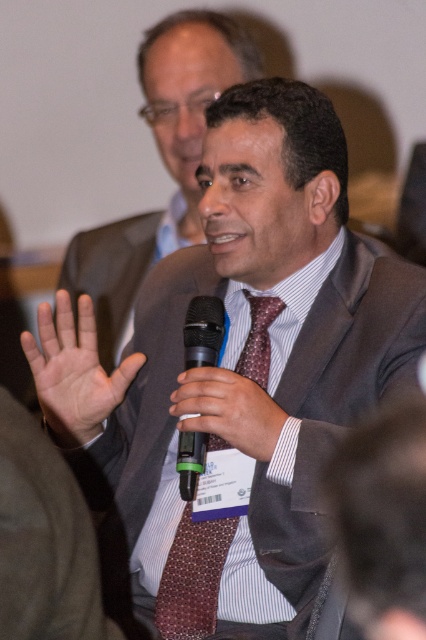
Question: Does smooth skin hand at center have a larger size compared to black matte microphone at center?

Choices:
 (A) yes
 (B) no

Answer: (A)

Question: Does matte black suit at center lie behind black plastic microphone at center?

Choices:
 (A) yes
 (B) no

Answer: (A)

Question: Which of the following is the farthest from the observer?

Choices:
 (A) (259, 454)
 (B) (215, 438)
 (C) (279, 524)
 (D) (97, 428)

Answer: (B)

Question: Can you confirm if dark gray textured suit at center is positioned above smooth skin hand at center?

Choices:
 (A) yes
 (B) no

Answer: (B)

Question: Based on their relative distances, which object is nearer to the maroon textured tie at center?

Choices:
 (A) smooth skin hand at center
 (B) matte black suit at center
 (C) black matte microphone at center

Answer: (C)

Question: Based on their relative distances, which object is farther from the dark gray textured suit at center?

Choices:
 (A) matte black suit at center
 (B) smooth skin hand at center
 (C) maroon textured tie at center

Answer: (A)